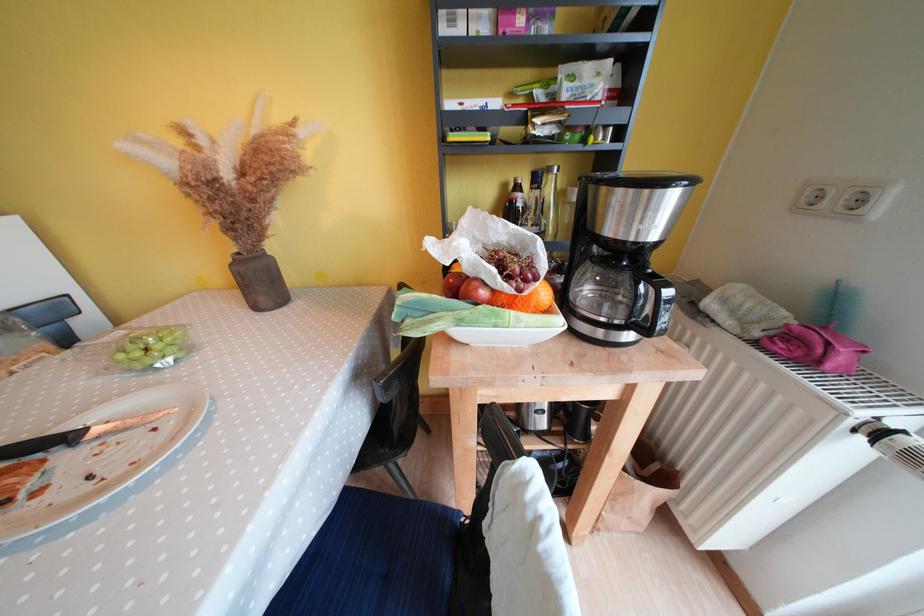
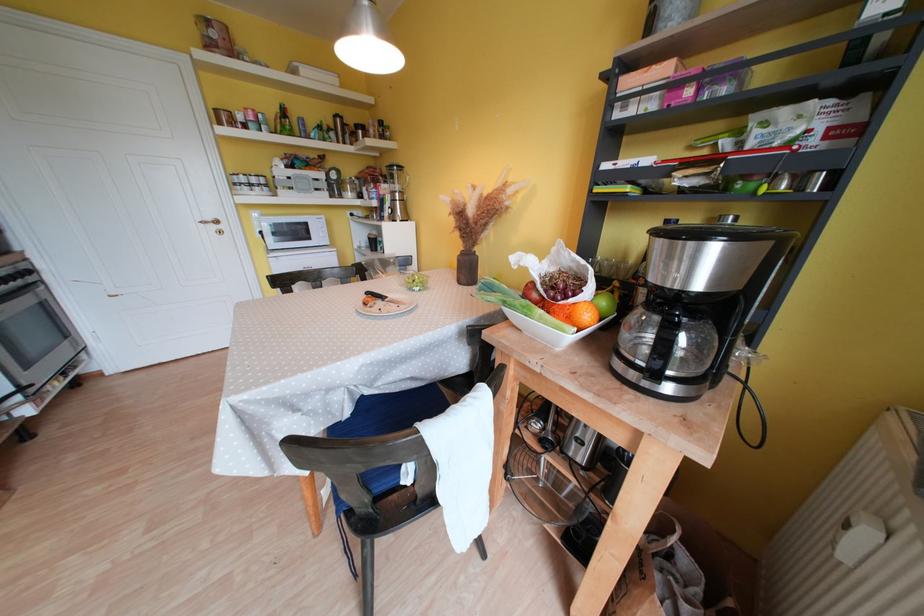
Question: The first image is from the beginning of the video and the second image is from the end. How did the camera likely rotate when shooting the video?

Choices:
 (A) Left
 (B) Right
 (C) Up
 (D) Down

Answer: (A)